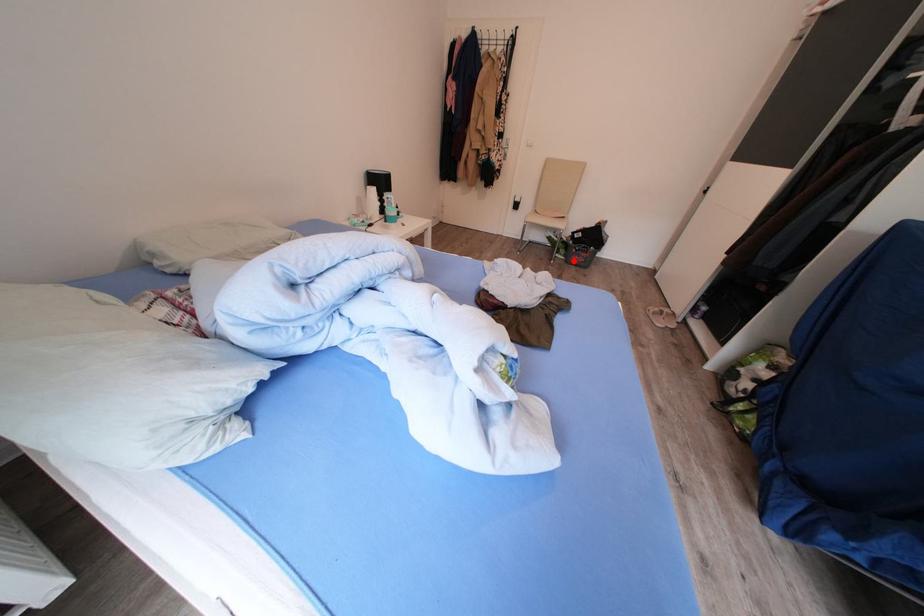
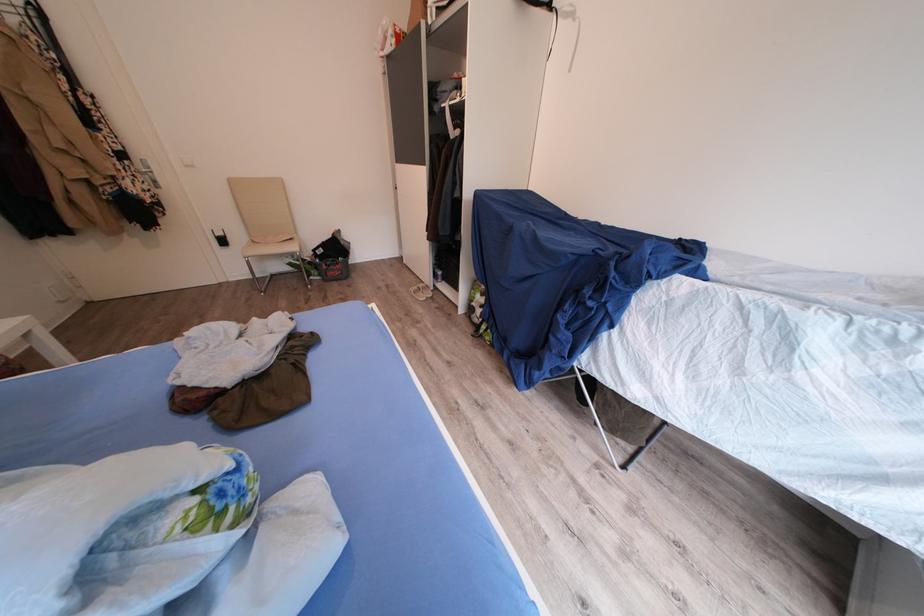
Question: I am providing you with two images of the same scene from different viewpoints. In image1, a red point is highlighted. Considering the same 3D point in image2, which of the following is correct?

Choices:
 (A) It is closer
 (B) It is farther

Answer: (A)